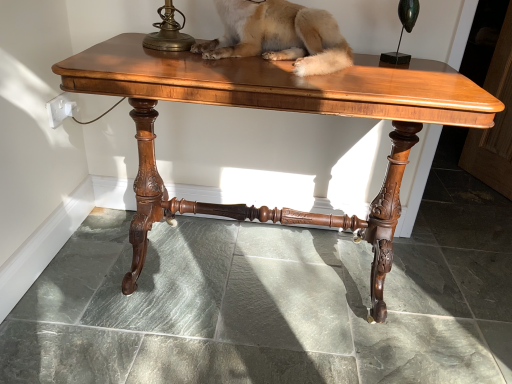
Locate an element on the screen. This screenshot has height=384, width=512. free point below fuzzy beige dog at center (from a real-world perspective) is located at coordinates (259, 61).